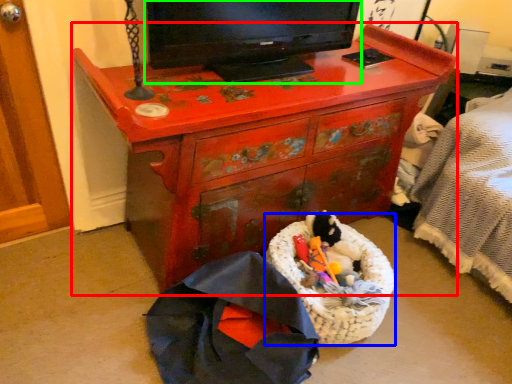
Question: Which is nearer to the chest of drawers (highlighted by a red box)? laundry basket (highlighted by a blue box) or television (highlighted by a green box).

Choices:
 (A) laundry basket
 (B) television

Answer: (B)